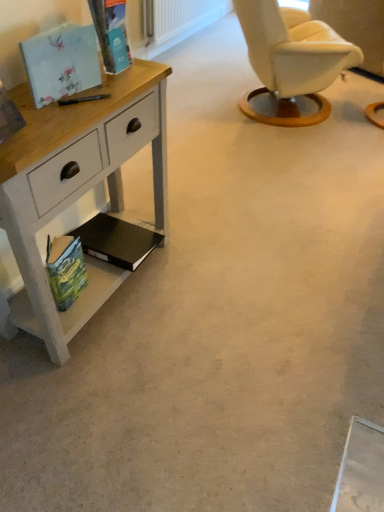
Question: Would you say matte floral-patterned book at upper left, which appears as the 3th magazine when ordered from the bottom, is to the left or to the right of black matte book at lower left, arranged as the third magazine when viewed from the top, in the picture?

Choices:
 (A) left
 (B) right

Answer: (A)

Question: Is matte floral-patterned book at upper left, which appears as the 3th magazine when ordered from the bottom, taller or shorter than black matte book at lower left, arranged as the third magazine when viewed from the top?

Choices:
 (A) tall
 (B) short

Answer: (A)

Question: Estimate the real-world distances between objects in this image. Which object is farther from the matte floral-patterned book at upper left, which appears as the 3th magazine when ordered from the bottom?

Choices:
 (A) white painted wood desk at left
 (B) matte cardboard magazine at upper left, which is the fourth magazine in bottom-to-top order
 (C) green matte book at lower left, acting as the 4th magazine starting from the top
 (D) black matte book at lower left, arranged as the third magazine when viewed from the top

Answer: (D)

Question: Which object is positioned farthest from the green matte book at lower left, the first magazine from the bottom?

Choices:
 (A) matte cardboard magazine at upper left, which is the 1th magazine from top to bottom
 (B) black matte book at lower left, the 2th magazine from the bottom
 (C) white painted wood desk at left
 (D) matte floral-patterned book at upper left, the 2th magazine from the top

Answer: (A)